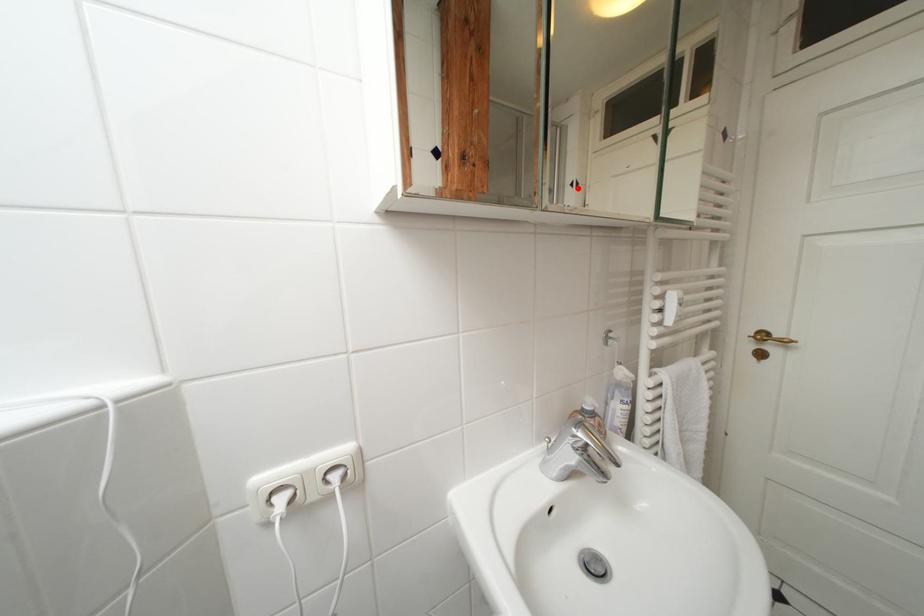
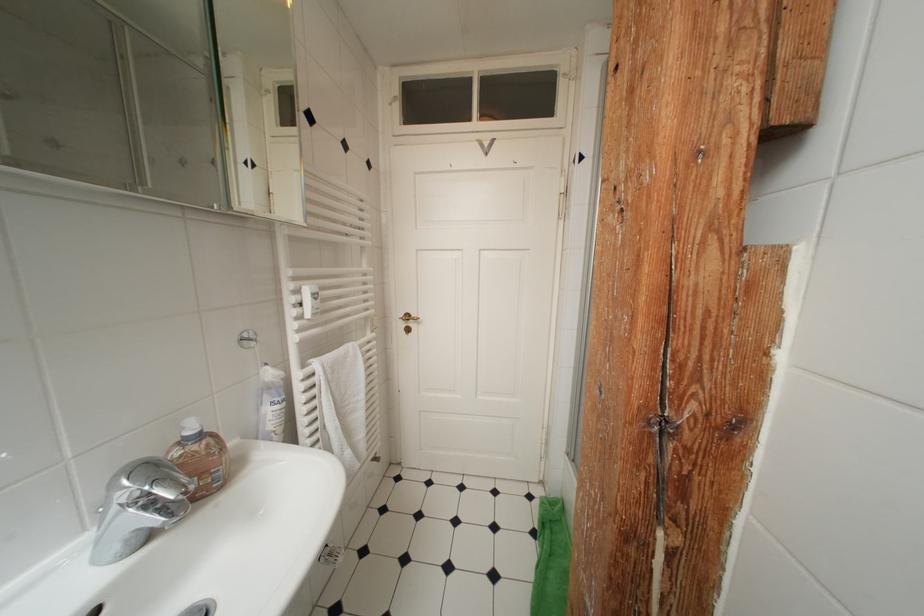
Locate, in the second image, the point that corresponds to the highlighted location in the first image.

(253, 167)